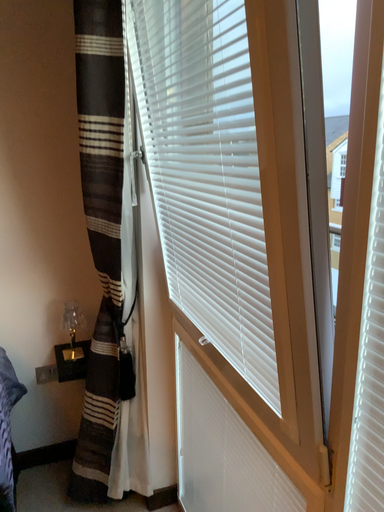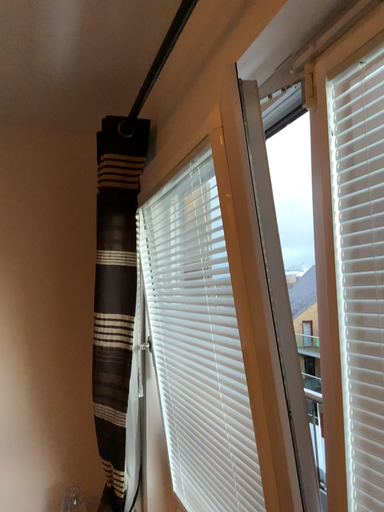
Question: Which way did the camera rotate in the video?

Choices:
 (A) rotated downward
 (B) rotated upward

Answer: (B)